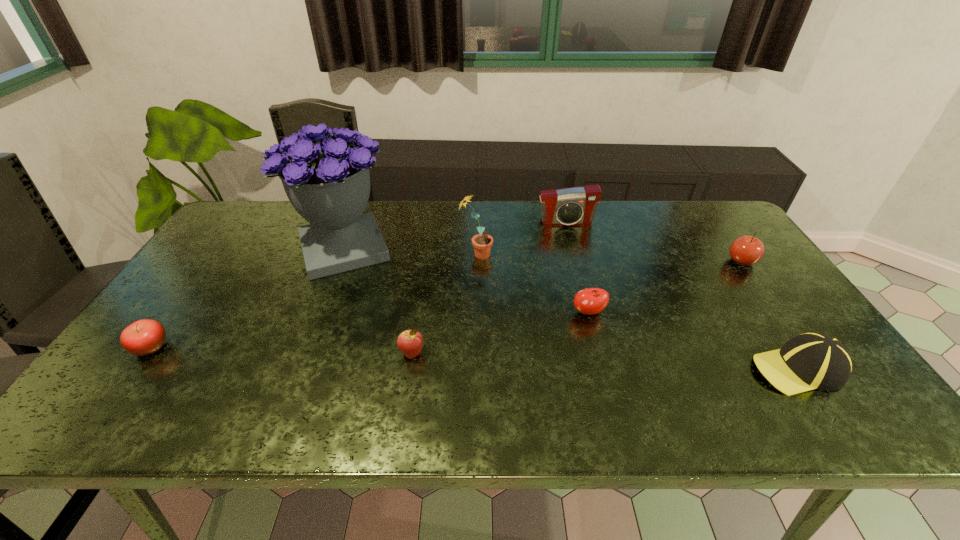
The height and width of the screenshot is (540, 960). I want to click on the leftmost apple, so click(x=143, y=337).

Image resolution: width=960 pixels, height=540 pixels. Find the location of `free space located on the back of the tallest object`. free space located on the back of the tallest object is located at coordinates (359, 207).

Identify the location of vacant space located on the flower of the sunflower. The image size is (960, 540). (598, 255).

Locate an element on the screen. Image resolution: width=960 pixels, height=540 pixels. vacant area situated on the front-facing side of the third tallest object is located at coordinates (583, 286).

Identify the location of vacant space situated 0.390m on the left of the farthest apple. The width and height of the screenshot is (960, 540). (596, 261).

Find the location of `free spot located 0.200m on the left of the third apple from left to right`. free spot located 0.200m on the left of the third apple from left to right is located at coordinates (495, 312).

In order to click on vacant space located on the right of the third object from left to right in this screenshot , I will do `click(450, 353)`.

Where is `free spot located with the brim of the baseball cap facing forward`? The height and width of the screenshot is (540, 960). free spot located with the brim of the baseball cap facing forward is located at coordinates (636, 368).

What are the coordinates of `vacant position located with the brim of the baseball cap facing forward` in the screenshot? It's located at (654, 368).

This screenshot has width=960, height=540. I want to click on vacant space located 0.280m with the brim of the baseball cap facing forward, so click(x=632, y=368).